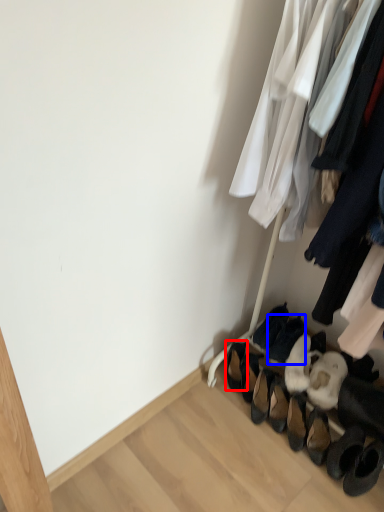
Question: Among these objects, which one is nearest to the camera, footwear (highlighted by a red box) or footwear (highlighted by a blue box)?

Choices:
 (A) footwear
 (B) footwear

Answer: (B)